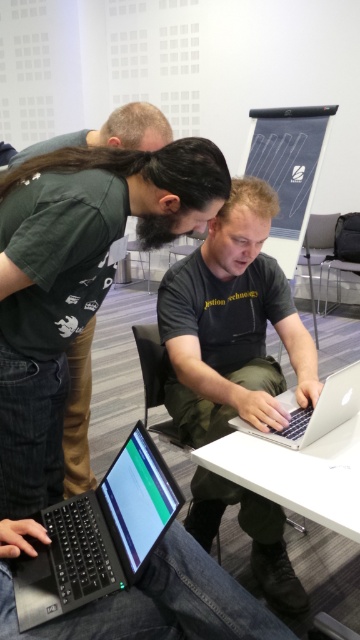
Question: Is matte black laptop at lower left thinner than silver metallic laptop at center?

Choices:
 (A) no
 (B) yes

Answer: (A)

Question: Based on their relative distances, which object is nearer to the silver metallic laptop at center?

Choices:
 (A) black matte laptop at lower left
 (B) matte black laptop at lower left

Answer: (A)

Question: Considering the relative positions of black matte laptop at lower left and silver metallic laptop at center in the image provided, where is black matte laptop at lower left located with respect to silver metallic laptop at center?

Choices:
 (A) above
 (B) below

Answer: (B)

Question: Among these points, which one is farthest from the camera?

Choices:
 (A) (128, 435)
 (B) (59, 189)

Answer: (A)

Question: Which point is closer to the camera taking this photo?

Choices:
 (A) (24, 342)
 (B) (194, 413)
 (C) (335, 426)

Answer: (A)

Question: Can you confirm if matte black laptop at lower left is wider than silver metallic laptop at center?

Choices:
 (A) no
 (B) yes

Answer: (B)